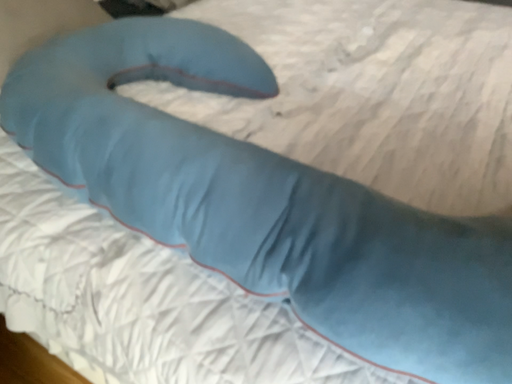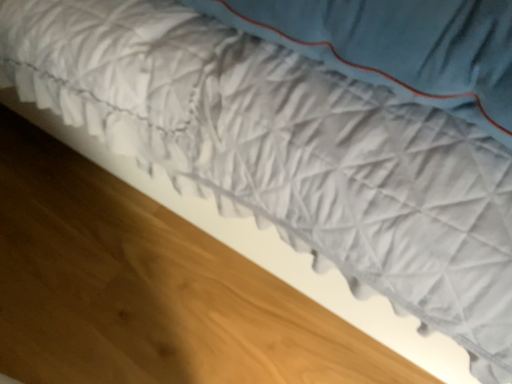
Question: How did the camera likely rotate when shooting the video?

Choices:
 (A) rotated downward
 (B) rotated upward

Answer: (A)